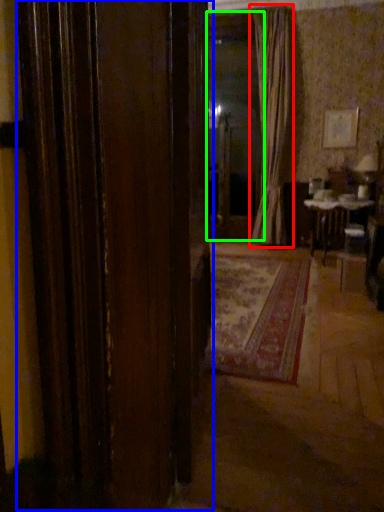
Question: Which object is positioned farthest from curtain (highlighted by a red box)? Select from door (highlighted by a blue box) and window screen (highlighted by a green box).

Choices:
 (A) door
 (B) window screen

Answer: (A)